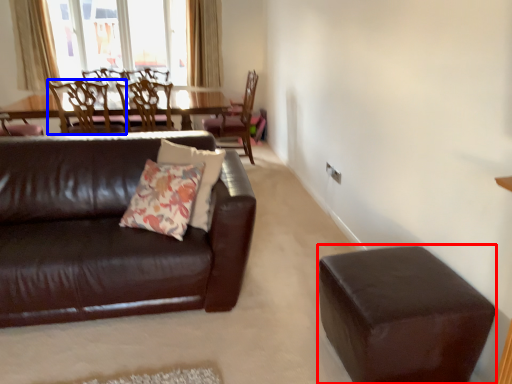
Question: Which object is further to the camera taking this photo, stool (highlighted by a red box) or chair (highlighted by a blue box)?

Choices:
 (A) stool
 (B) chair

Answer: (B)